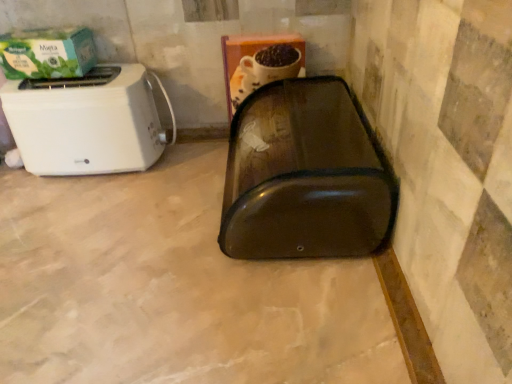
Question: Relative to transparent plastic bread bin at center, is white plastic toaster at left in front or behind?

Choices:
 (A) behind
 (B) front

Answer: (A)

Question: Is point coord(91,155) closer or farther from the camera than point coord(322,228)?

Choices:
 (A) farther
 (B) closer

Answer: (A)

Question: Based on their relative distances, which object is farther from the white plastic toaster at left?

Choices:
 (A) transparent plastic bread bin at center
 (B) green matte box at upper left
 (C) transparent plastic bread bin at center

Answer: (C)

Question: Estimate the real-world distances between objects in this image. Which object is farther from the transparent plastic bread bin at center?

Choices:
 (A) green matte box at upper left
 (B) transparent plastic bread bin at center
 (C) white plastic toaster at left

Answer: (A)